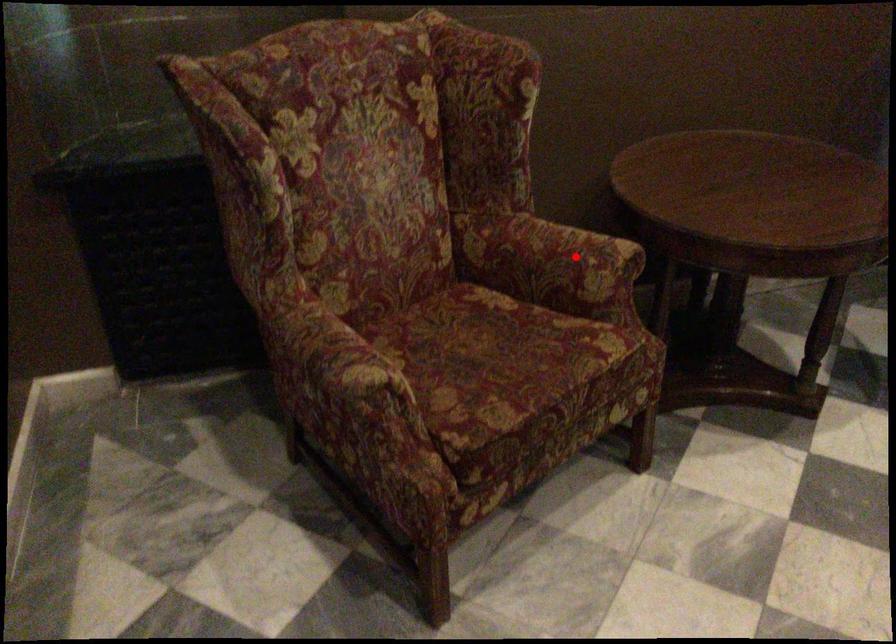
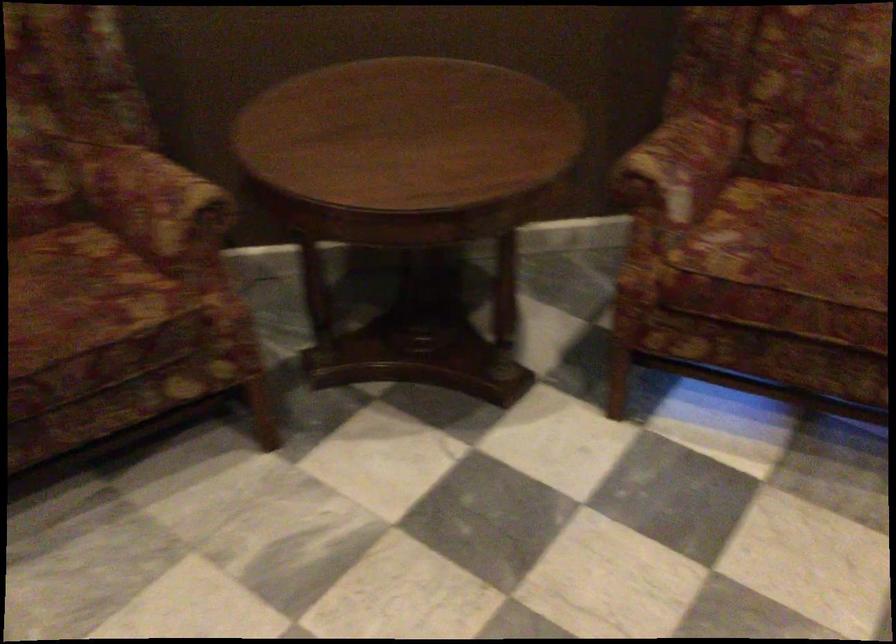
Question: I am providing you with two images of the same scene from different viewpoints. In image1, a red point is highlighted. Considering the same 3D point in image2, which of the following is correct?

Choices:
 (A) It is closer
 (B) It is farther

Answer: (A)